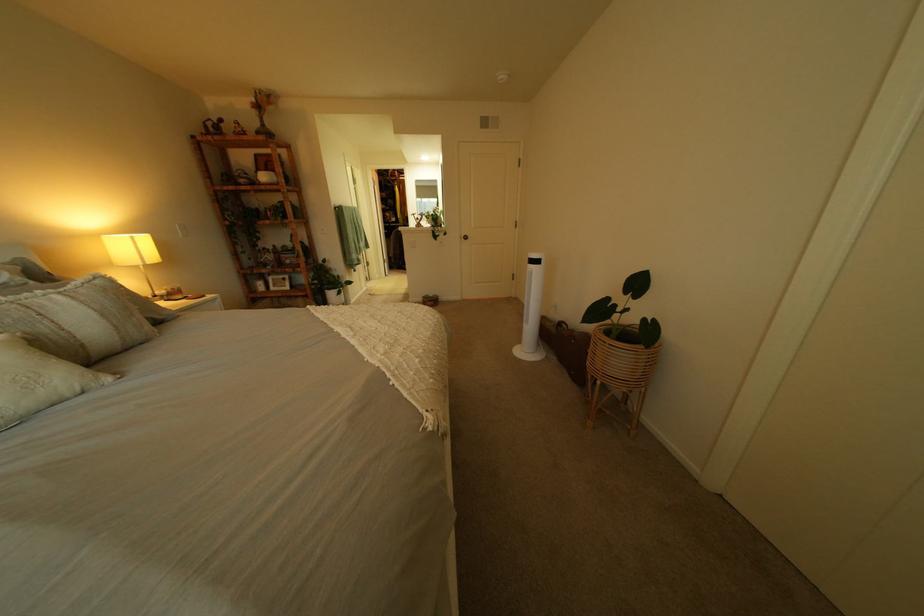
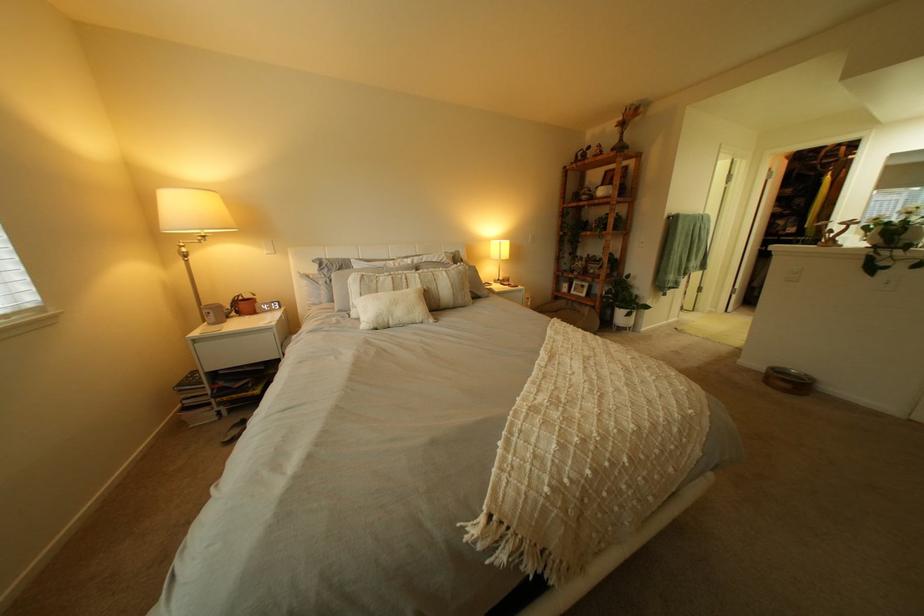
Find the pixel in the second image that matches the point at 435,301 in the first image.

(779, 369)